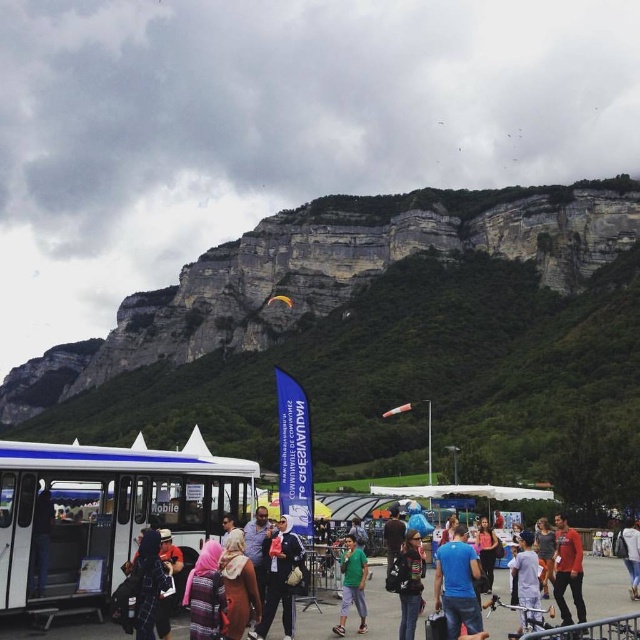
Does point (216, 580) come farther from viewer compared to point (138, 557)?

No, (216, 580) is in front of (138, 557).

Which is below, striped fabric headscarf at center or plaid fabric jacket at lower left?

striped fabric headscarf at center is lower down.

Measure the distance between point (193, 632) and camera.

A distance of 200.39 feet exists between point (193, 632) and camera.

At what (x,y) coordinates should I click in order to perform the action: click on striped fabric headscarf at center. Please return your answer as a coordinate pair (x, y). The width and height of the screenshot is (640, 640). Looking at the image, I should click on (205, 595).

Can you confirm if black leather jacket at center is shorter than dark brown leather jacket at center?

Yes.

Who is positioned more to the right, black leather jacket at center or dark brown leather jacket at center?

dark brown leather jacket at center is more to the right.

Between point (417, 557) and point (397, 532), which one is positioned behind?

Point (397, 532)

The height and width of the screenshot is (640, 640). I want to click on black leather jacket at center, so click(406, 582).

Can you confirm if black leather jacket at center is shorter than light gray fabric pants at center?

No.

Between black leather jacket at center and light gray fabric pants at center, which one has more height?

Standing taller between the two is black leather jacket at center.

Find the location of `black leather jacket at center`. black leather jacket at center is located at coordinates (406, 582).